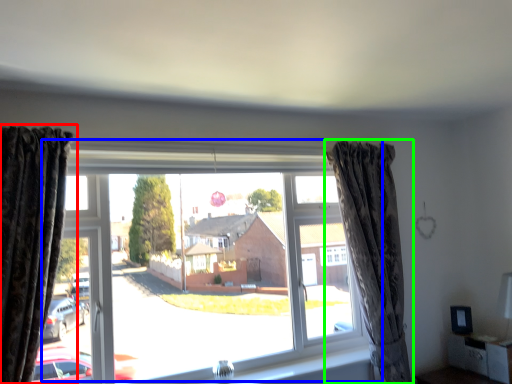
Question: Which object is positioned closest to curtain (highlighted by a red box)? Select from window (highlighted by a blue box) and curtain (highlighted by a green box).

Choices:
 (A) window
 (B) curtain

Answer: (A)